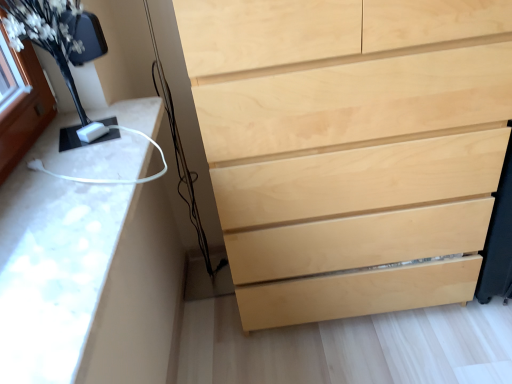
At what (x,y) coordinates should I click in order to perform the action: click on vacant area that is in front of light wood chest of drawers at center. Please return your answer as a coordinate pair (x, y). This screenshot has height=384, width=512. Looking at the image, I should click on (378, 354).